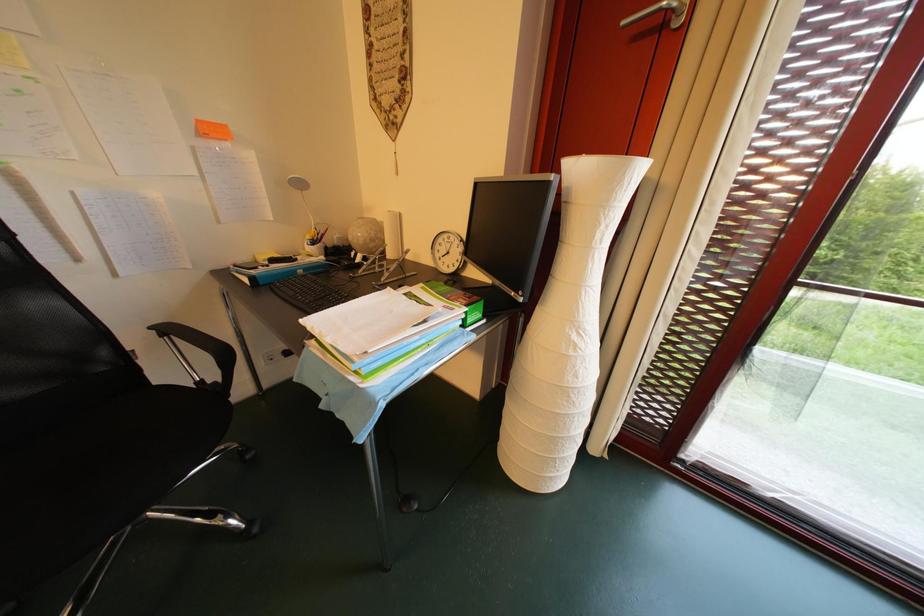
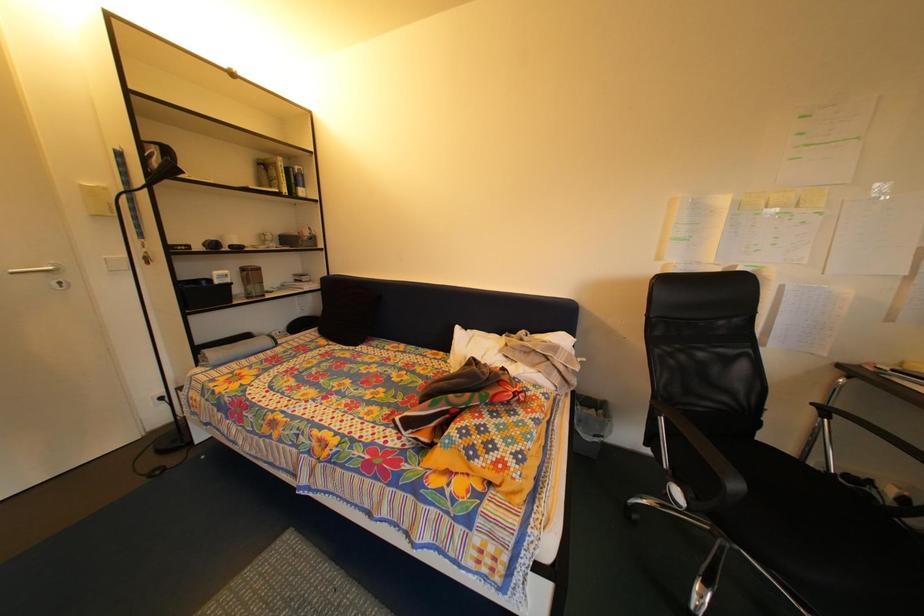
Question: The first image is from the beginning of the video and the second image is from the end. How did the camera likely rotate when shooting the video?

Choices:
 (A) Left
 (B) Right
 (C) Up
 (D) Down

Answer: (A)